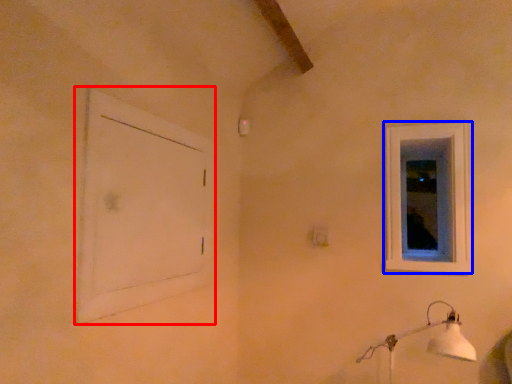
Question: Which object appears closest to the camera in this image, window frame (highlighted by a red box) or window (highlighted by a blue box)?

Choices:
 (A) window frame
 (B) window

Answer: (A)